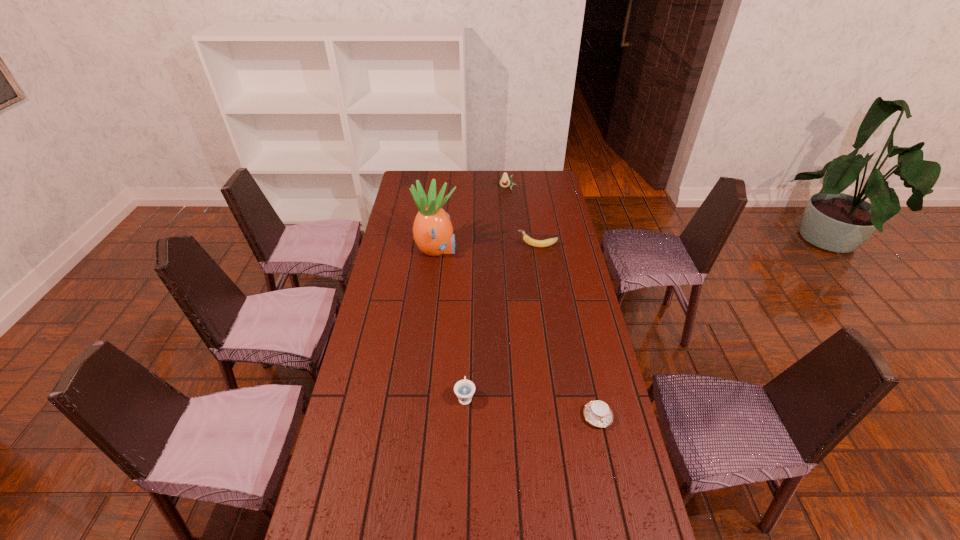
Locate an element on the screen. blank space that satisfies the following two spatial constraints: 1. on the side of the fourth tallest object with the handle; 2. at the entrance of the leftmost object is located at coordinates (469, 250).

At what (x,y) coordinates should I click in order to perform the action: click on free space that satisfies the following two spatial constraints: 1. at the entrance of the tallest object; 2. on the side of the left teacup with the handle. Please return your answer as a coordinate pair (x, y). Looking at the image, I should click on (420, 396).

You are a GUI agent. You are given a task and a screenshot of the screen. Output one action in this format:
    pyautogui.click(x=<x>, y=<y>)
    Task: Click on the vacant space that satisfies the following two spatial constraints: 1. on the seed side of the farthest object; 2. at the entrance of the tallest object
    The image size is (960, 540).
    Given the screenshot: What is the action you would take?
    pyautogui.click(x=514, y=250)

Identify the location of vacant region that satisfies the following two spatial constraints: 1. on the side of the left teacup with the handle; 2. at the entrance of the tallest object. (469, 250).

Identify the location of free space that satisfies the following two spatial constraints: 1. at the entrance of the pineapple; 2. on the side of the fourth tallest object with the handle. (420, 396).